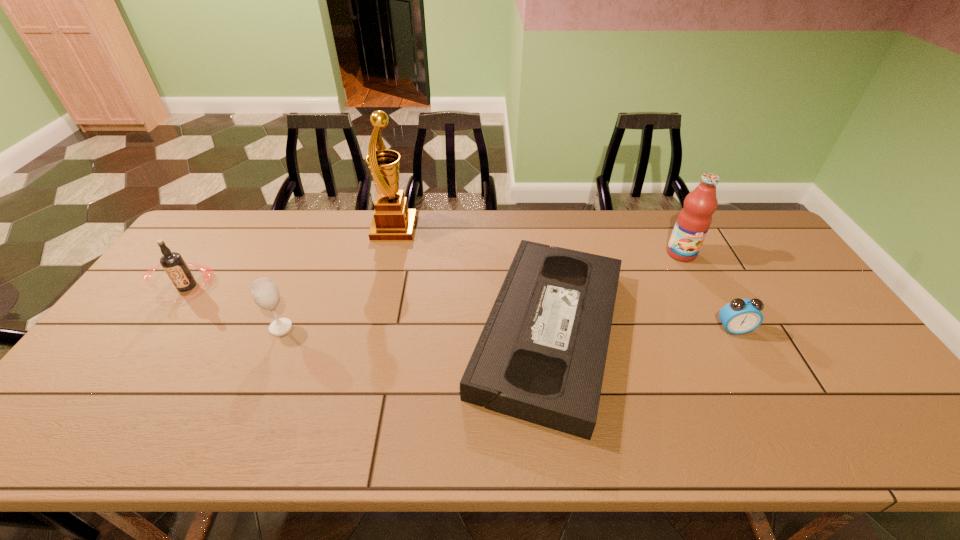
Identify the location of free space located 0.400m on the label of the root beer. (83, 437).

Locate an element on the screen. free spot located on the left of the fifth object from right to left is located at coordinates (127, 328).

I want to click on free region located 0.130m on the face of the second shortest object, so click(759, 376).

Where is `blank area located on the right of the shortest object`? blank area located on the right of the shortest object is located at coordinates (768, 332).

You are a GUI agent. You are given a task and a screenshot of the screen. Output one action in this format:
    pyautogui.click(x=<x>, y=<y>)
    Task: Click on the award that is at the far edge
    This screenshot has width=960, height=540.
    Given the screenshot: What is the action you would take?
    point(392,221)

Identify the location of fruit juice that is at the far edge. (693, 222).

Where is `object that is at the near edge`? object that is at the near edge is located at coordinates (541, 355).

In order to click on object located in the left edge section of the desktop in this screenshot , I will do `click(172, 262)`.

Image resolution: width=960 pixels, height=540 pixels. Find the location of `vacant space at the far edge of the desktop`. vacant space at the far edge of the desktop is located at coordinates (361, 238).

In order to click on vacant position at the near edge of the desktop in this screenshot , I will do `click(316, 422)`.